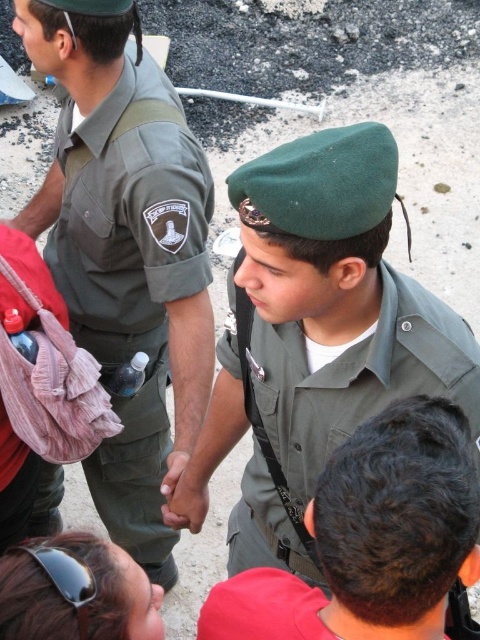
Consider the image. You are a tailor measuring uniforms for a military unit. You have two uniforms to compare in the image. Which uniform, the green fabric uniform at left or the green matte uniform at center, has a greater width?

The green fabric uniform at left has a greater width than the green matte uniform at center according to the description.

You are a drone operator trying to locate a specific point in a military training area. The point is marked as point [115,408]. Given that the point is 2.92 meters away from the camera, can you confirm if this point is within the visible area of the camera?

The point [115,408] is 2.92 meters away from the camera, so yes, it is within the visible area of the camera.